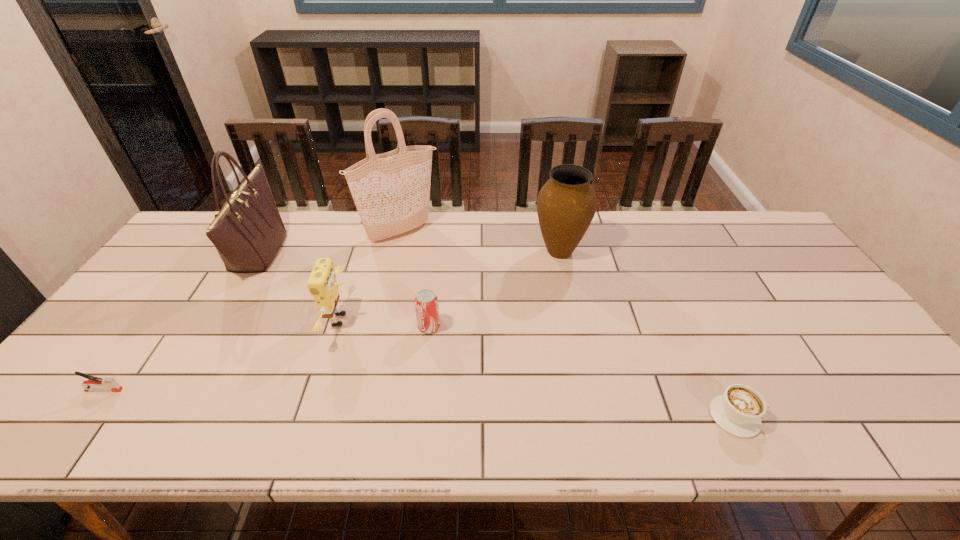
Locate an element on the screen. Image resolution: width=960 pixels, height=540 pixels. urn that is at the far edge is located at coordinates (566, 204).

This screenshot has width=960, height=540. I want to click on object at the near edge, so click(x=739, y=411).

You are a GUI agent. You are given a task and a screenshot of the screen. Output one action in this format:
    pyautogui.click(x=<x>, y=<y>)
    Task: Click on the object at the left edge
    
    Given the screenshot: What is the action you would take?
    pos(110,384)

The width and height of the screenshot is (960, 540). I want to click on vacant region at the far edge, so click(329, 211).

Find the location of `vacant space at the near edge of the desktop`. vacant space at the near edge of the desktop is located at coordinates (551, 445).

Where is `vacant region at the left edge`? vacant region at the left edge is located at coordinates (180, 292).

At what (x,y) coordinates should I click in order to perform the action: click on vacant area at the right edge of the desktop. Please return your answer as a coordinate pair (x, y). Looking at the image, I should click on (828, 334).

Locate an element on the screen. The width and height of the screenshot is (960, 540). free area in between the urn and the second tallest object is located at coordinates (409, 252).

In order to click on blank region between the sixth farthest object and the shopping bag in this screenshot , I will do `click(252, 311)`.

Where is `free spot between the cappuccino and the handbag`? The height and width of the screenshot is (540, 960). free spot between the cappuccino and the handbag is located at coordinates (497, 334).